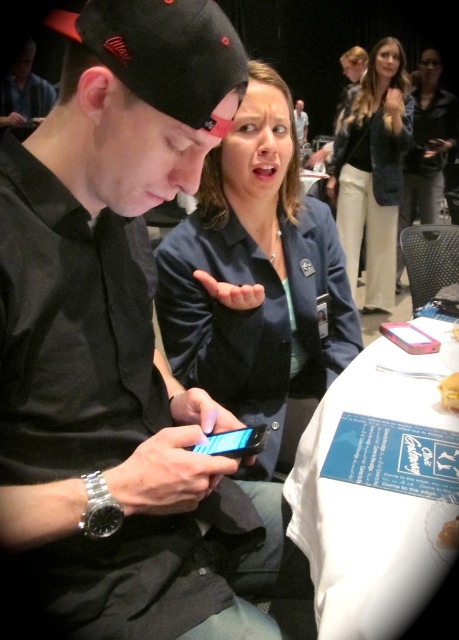
Question: Is white paper at lower right above matte black shirt at center?

Choices:
 (A) yes
 (B) no

Answer: (B)

Question: Does white paper at lower right appear over black leather jacket at upper right?

Choices:
 (A) yes
 (B) no

Answer: (B)

Question: Is white paper at lower right wider than dark blue blazer at upper right?

Choices:
 (A) no
 (B) yes

Answer: (A)

Question: Which point appears closest to the camera in this image?

Choices:
 (A) (328, 266)
 (B) (296, 109)
 (C) (33, 51)

Answer: (A)

Question: Which point is closer to the camera?

Choices:
 (A) tap(32, 115)
 (B) tap(302, 99)

Answer: (A)

Question: Which point is farther to the camera?

Choices:
 (A) (27, 74)
 (B) (233, 429)
 (C) (399, 369)
 (D) (307, 122)

Answer: (D)